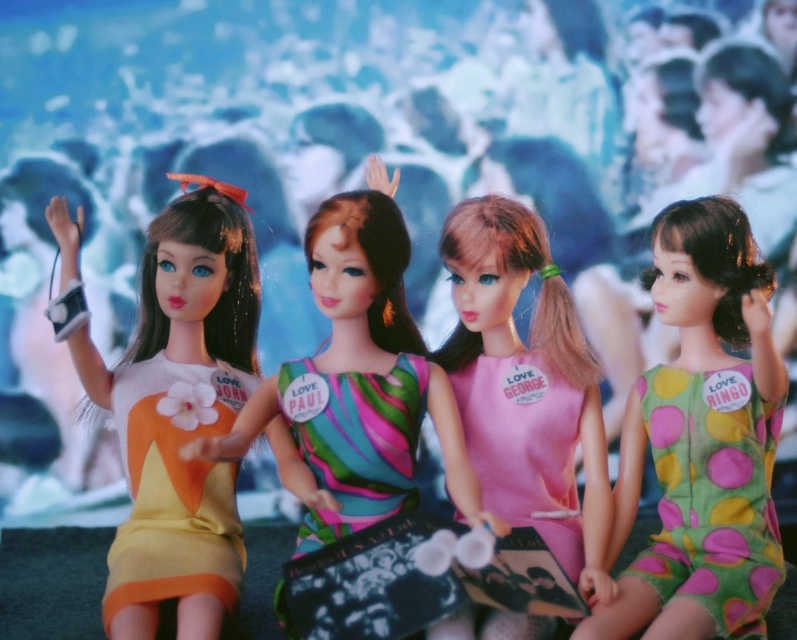
Question: In this image, where is green polka dot dress at center located relative to matte plastic doll at center?

Choices:
 (A) below
 (B) above

Answer: (A)

Question: Which object is the closest to the matte plastic doll at left?

Choices:
 (A) matte plastic doll at center
 (B) green polka dot dress at center

Answer: (A)

Question: Is green polka dot dress at center smaller than matte plastic doll at left?

Choices:
 (A) yes
 (B) no

Answer: (A)

Question: Estimate the real-world distances between objects in this image. Which object is farther from the pink fabric dress at center?

Choices:
 (A) matte plastic doll at center
 (B) green polka dot dress at center
 (C) matte plastic doll at left

Answer: (C)

Question: Which object appears closest to the camera in this image?

Choices:
 (A) matte plastic doll at left
 (B) matte plastic doll at center
 (C) green polka dot dress at center
 (D) pink fabric dress at center

Answer: (B)

Question: Can you confirm if pink fabric dress at center is bigger than matte plastic doll at center?

Choices:
 (A) yes
 (B) no

Answer: (B)